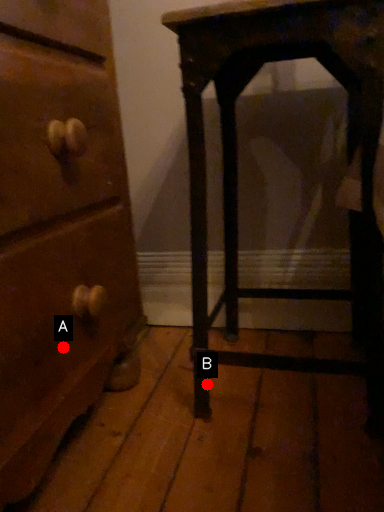
Question: Two points are circled on the image, labeled by A and B beside each circle. Which point is farther to the camera?

Choices:
 (A) A is further
 (B) B is further

Answer: (B)